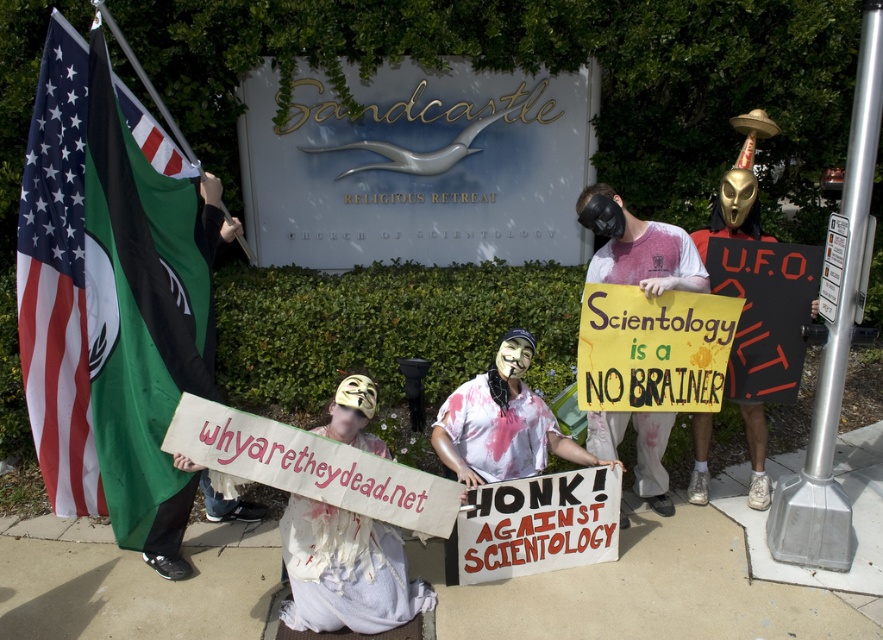
Is point (142, 134) positioned in front of point (487, 468)?

No, it is not.

The image size is (883, 640). What do you see at coordinates (109, 298) in the screenshot?
I see `american flag at left` at bounding box center [109, 298].

At what (x,y) coordinates should I click in order to perform the action: click on american flag at left. Please return your answer as a coordinate pair (x, y). Image resolution: width=883 pixels, height=640 pixels. Looking at the image, I should click on (109, 298).

Can you confirm if white cloth mask at center is taller than blood-stained t-shirt at center?

Correct, white cloth mask at center is much taller as blood-stained t-shirt at center.

Can you confirm if white cloth mask at center is positioned to the left of blood-stained t-shirt at center?

Correct, you'll find white cloth mask at center to the left of blood-stained t-shirt at center.

Where is `white cloth mask at center`? The width and height of the screenshot is (883, 640). white cloth mask at center is located at coordinates (345, 570).

Image resolution: width=883 pixels, height=640 pixels. Find the location of `white cloth mask at center`. white cloth mask at center is located at coordinates (345, 570).

Does point (629, 241) come in front of point (510, 468)?

Yes, it is in front of point (510, 468).

Who is positioned more to the right, blood-stained t-shirt at center or white paper mask at center?

blood-stained t-shirt at center is more to the right.

Is point (589, 435) farther from camera compared to point (481, 451)?

Yes, point (589, 435) is farther from viewer.

Locate an element on the screen. This screenshot has height=640, width=883. blood-stained t-shirt at center is located at coordinates (638, 248).